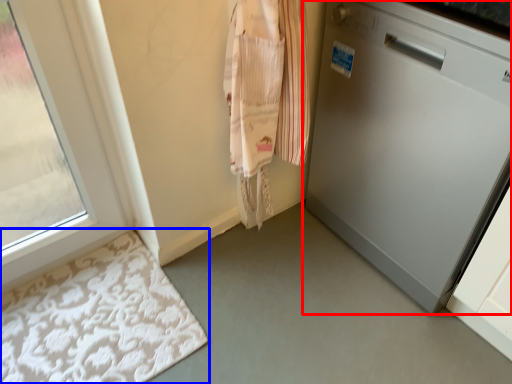
Question: Among these objects, which one is nearest to the camera, home appliance (highlighted by a red box) or bath mat (highlighted by a blue box)?

Choices:
 (A) home appliance
 (B) bath mat

Answer: (A)